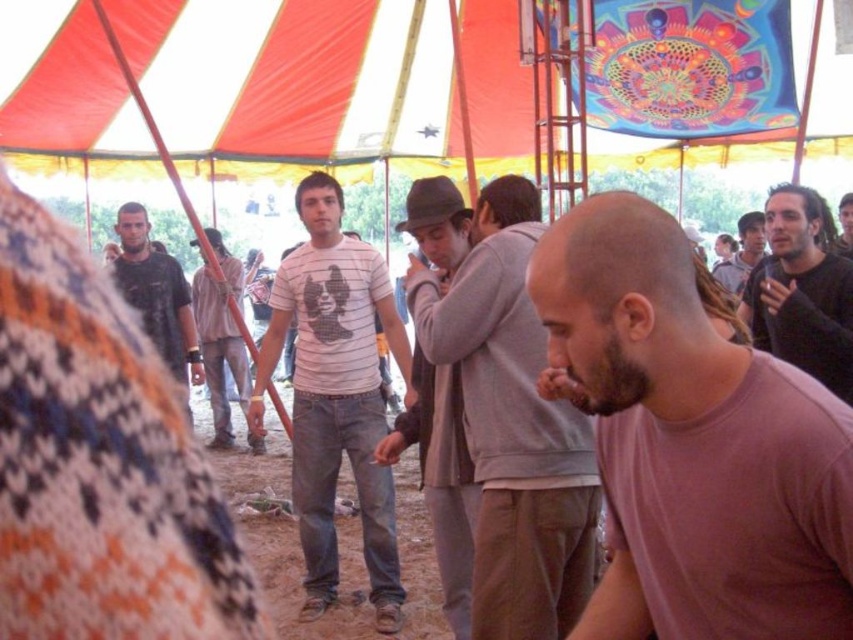
You are a photographer taking a picture of the scene. You notice the pink matte shirt at center and the gray woolen sweater at center. Which one is closer to the camera?

The pink matte shirt at center is closer to the camera because it is in front of the gray woolen sweater at center.

You are standing at the point marked as point (157, 296) in the image. Looking around, you see a dark gray shirt at left. What is the nearest object to you?

The nearest object to you is the dark gray shirt at left because the point (157, 296) is on it.

In the scene under the colorful tent, there are two people wearing a striped cotton shirt at center and a dark gray sweater at center. From the perspective of someone standing at the front of the tent, which clothing item is positioned to the left?

The striped cotton shirt at center is to the left of the dark gray sweater at center.